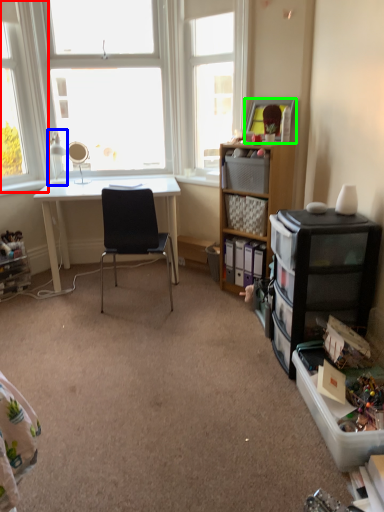
Question: Based on their relative distances, which object is farther from window (highlighted by a red box)? Choose from lamp (highlighted by a blue box) and picture frame (highlighted by a green box).

Choices:
 (A) lamp
 (B) picture frame

Answer: (B)